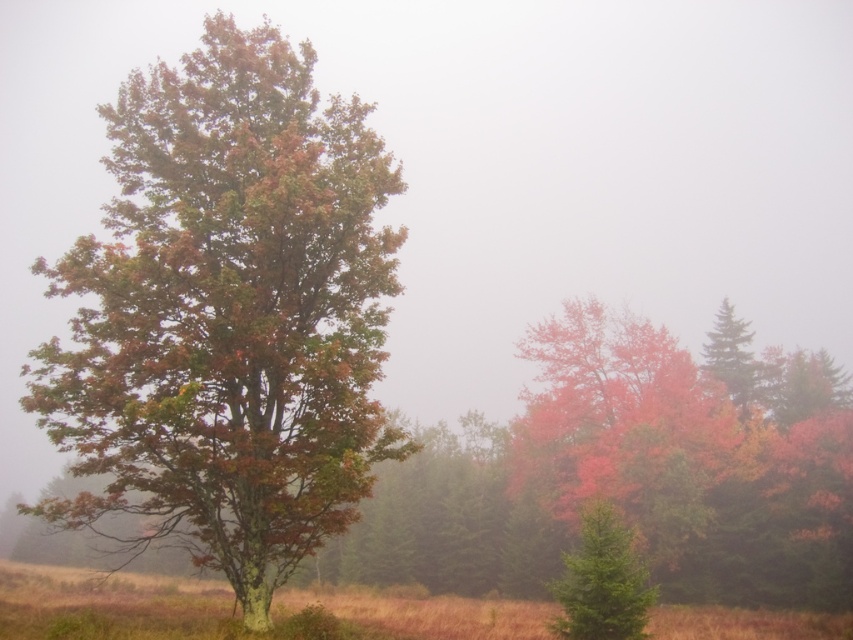
You are an artist planning to paint the scene. You need to decide the placement of the multicolored foliage tree at left and the green matte evergreen at lower right on your canvas. Based on their positions in the image, which tree should you place on the left side of your painting?

The multicolored foliage tree at left should be placed on the left side of your painting because it is positioned to the left of the green matte evergreen at lower right in the image.

You are an artist sketching the landscape and want to draw the multicolored foliage tree at left and the green matte tree at upper right. Based on their positions, which tree should you start with to maintain a natural left to right flow in your drawing?

You should start with the multicolored foliage tree at left because it is positioned to the left of the green matte tree at upper right, following a natural left to right flow.

You are a photographer standing at the edge of a misty autumn forest. You want to capture a closeup shot of the multicolored foliage tree at left. Considering your camera can focus on subjects within 10 meters, will you be able to take the photo without moving closer?

The multicolored foliage tree at left is 16.66 meters away from the camera, which is beyond the 10 meter focus range. Therefore, you cannot take a closeup shot without moving closer.